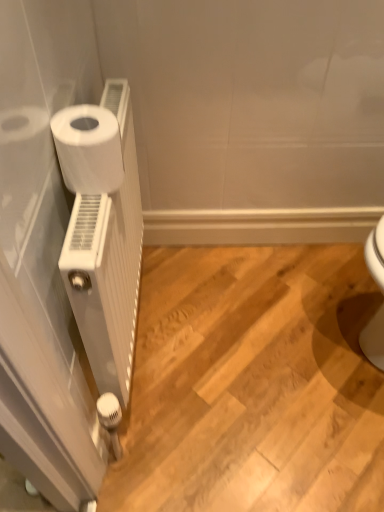
Question: Is white matte radiator at left behind white matte toilet paper at left?

Choices:
 (A) no
 (B) yes

Answer: (A)

Question: Is white matte radiator at left at the right side of white matte toilet paper at left?

Choices:
 (A) no
 (B) yes

Answer: (A)

Question: Does white matte radiator at left have a smaller size compared to white matte toilet paper at left?

Choices:
 (A) yes
 (B) no

Answer: (B)

Question: From the image's perspective, is white matte radiator at left below white matte toilet paper at left?

Choices:
 (A) no
 (B) yes

Answer: (B)

Question: Is white matte radiator at left next to white matte toilet paper at left and touching it?

Choices:
 (A) no
 (B) yes

Answer: (A)

Question: Considering the relative sizes of white matte radiator at left and white matte toilet paper at left in the image provided, is white matte radiator at left wider than white matte toilet paper at left?

Choices:
 (A) yes
 (B) no

Answer: (B)

Question: Does white matte radiator at left have a greater width compared to white matte radiator at left?

Choices:
 (A) yes
 (B) no

Answer: (B)

Question: Considering the relative sizes of white matte radiator at left and white matte radiator at left in the image provided, is white matte radiator at left bigger than white matte radiator at left?

Choices:
 (A) yes
 (B) no

Answer: (B)

Question: Considering the relative positions of white matte radiator at left and white matte radiator at left in the image provided, is white matte radiator at left to the left of white matte radiator at left from the viewer's perspective?

Choices:
 (A) yes
 (B) no

Answer: (A)

Question: Considering the relative sizes of white matte radiator at left and white matte radiator at left in the image provided, is white matte radiator at left thinner than white matte radiator at left?

Choices:
 (A) no
 (B) yes

Answer: (B)

Question: Can you confirm if white matte radiator at left is positioned to the right of white matte radiator at left?

Choices:
 (A) no
 (B) yes

Answer: (A)

Question: Are white matte radiator at left and white matte radiator at left located far from each other?

Choices:
 (A) yes
 (B) no

Answer: (B)

Question: Does white matte toilet paper at left have a greater width compared to white matte radiator at left?

Choices:
 (A) yes
 (B) no

Answer: (A)